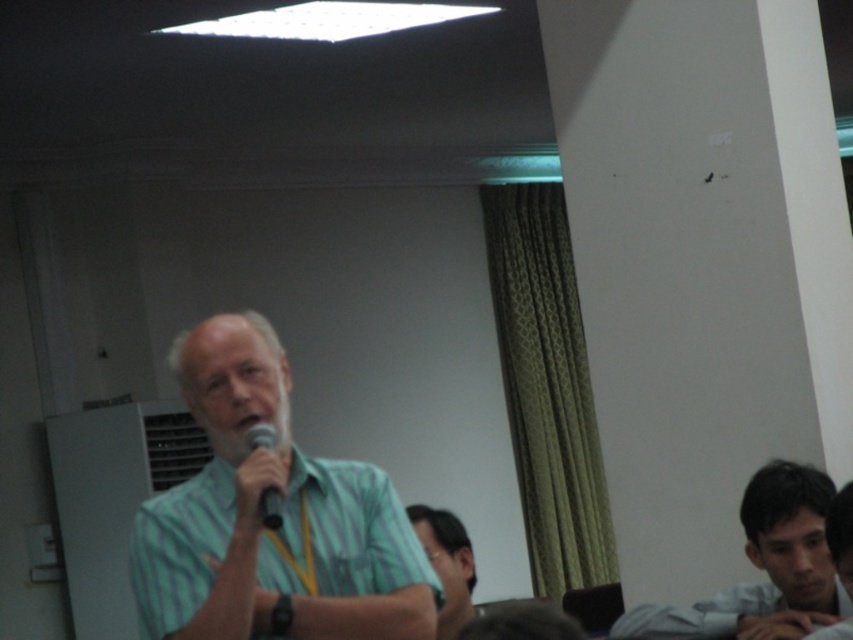
Question: Which point is closer to the camera?

Choices:
 (A) coord(815,474)
 (B) coord(273,529)

Answer: (B)

Question: Which object is positioned closest to the black matte microphone at center?

Choices:
 (A) green striped shirt at center
 (B) light blue shirt at lower right
 (C) matte green shirt at lower center

Answer: (A)

Question: Which of the following is the closest to the observer?

Choices:
 (A) (254, 426)
 (B) (144, 538)
 (C) (442, 627)
 (D) (750, 600)

Answer: (B)

Question: Is matte green shirt at lower center to the left of black matte microphone at center from the viewer's perspective?

Choices:
 (A) no
 (B) yes

Answer: (A)

Question: Does green striped shirt at center have a smaller size compared to matte green shirt at lower center?

Choices:
 (A) no
 (B) yes

Answer: (A)

Question: Where is matte green shirt at lower center located in relation to black matte microphone at center in the image?

Choices:
 (A) below
 (B) above

Answer: (A)